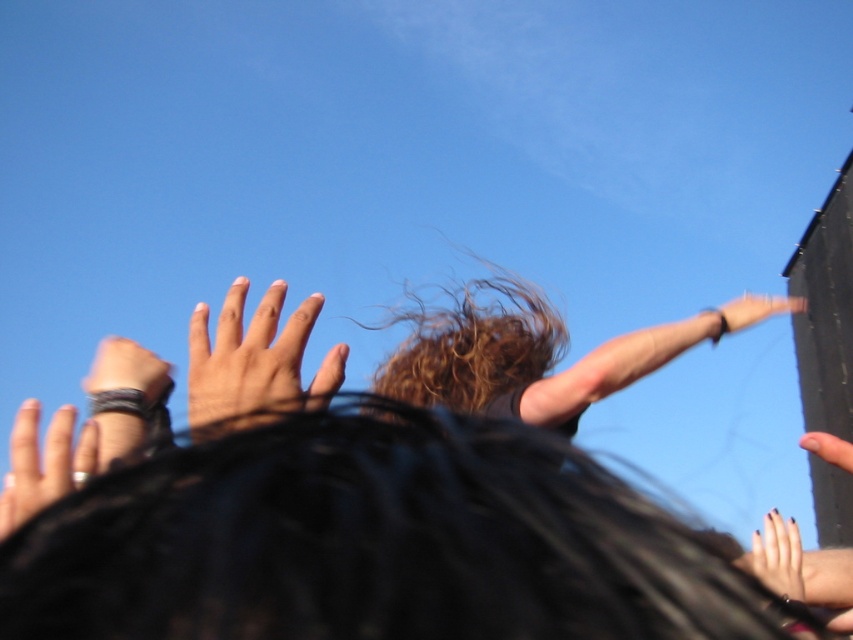
From the picture: Is leather wristband at upper left to the left of smooth skin finger at upper right from the viewer's perspective?

Indeed, leather wristband at upper left is positioned on the left side of smooth skin finger at upper right.

Can you confirm if leather wristband at upper left is wider than smooth skin finger at upper right?

No.

Which is in front, point (96, 376) or point (849, 444)?

Point (96, 376) is in front.

Identify the location of leather wristband at upper left. The width and height of the screenshot is (853, 640). (128, 401).

Is curly brown hair at center closer to camera compared to black matte hand at upper center?

No, curly brown hair at center is further to the viewer.

Can you confirm if curly brown hair at center is thinner than black matte hand at upper center?

Incorrect, curly brown hair at center's width is not less than black matte hand at upper center's.

Between point (434, 368) and point (775, 580), which one is positioned behind?

The point (434, 368) is more distant.

The height and width of the screenshot is (640, 853). What are the coordinates of `curly brown hair at center` in the screenshot? It's located at (473, 348).

Based on the photo, between smooth skin hand at upper right and smooth skin finger at upper right, which one has more height?

With more height is smooth skin finger at upper right.

Can you confirm if smooth skin hand at upper right is positioned to the left of smooth skin finger at upper right?

Incorrect, smooth skin hand at upper right is not on the left side of smooth skin finger at upper right.

Between point (734, 304) and point (850, 451), which one is positioned in front?

Positioned in front is point (850, 451).

I want to click on smooth skin hand at upper right, so click(x=756, y=308).